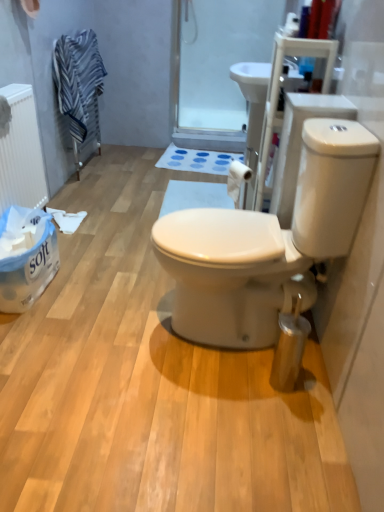
Locate an element on the screen. The width and height of the screenshot is (384, 512). vacant point above blue fabric bath mat at center (from a real-world perspective) is located at coordinates (201, 157).